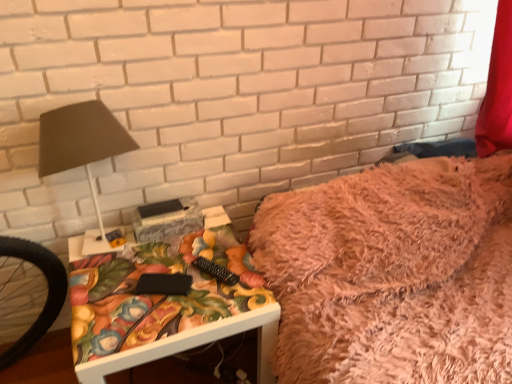
Question: Considering the positions of point (271, 334) and point (62, 140), is point (271, 334) closer or farther from the camera than point (62, 140)?

Choices:
 (A) farther
 (B) closer

Answer: (A)

Question: Considering the positions of white glossy table at lower left and matte black lamp at left in the image, is white glossy table at lower left bigger or smaller than matte black lamp at left?

Choices:
 (A) big
 (B) small

Answer: (A)

Question: Estimate the real-world distances between objects in this image. Which object is closer to the fuzzy pink blanket at upper right?

Choices:
 (A) white glossy table at lower left
 (B) matte black lamp at left

Answer: (A)

Question: Which object is positioned farthest from the matte black lamp at left?

Choices:
 (A) fuzzy pink blanket at upper right
 (B) white glossy table at lower left

Answer: (A)